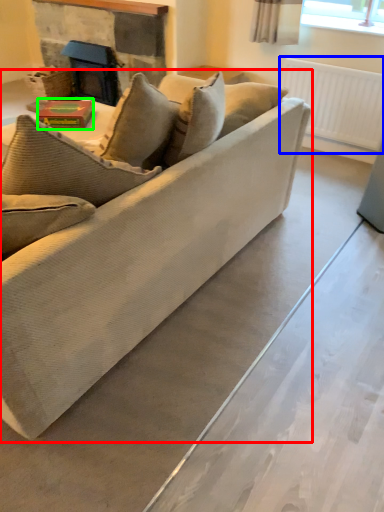
Question: Which object is the closest to the studio couch (highlighted by a red box)? Choose among these: radiator (highlighted by a blue box) or book (highlighted by a green box).

Choices:
 (A) radiator
 (B) book

Answer: (B)